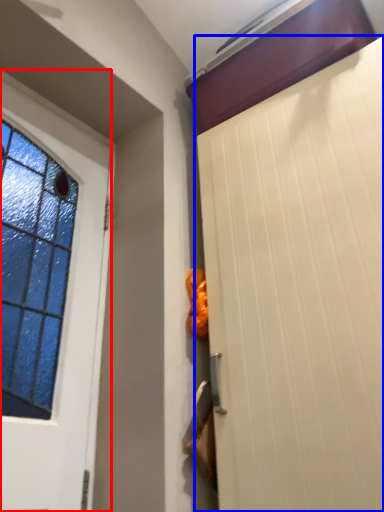
Question: Which of the following is the farthest to the observer, door (highlighted by a red box) or door (highlighted by a blue box)?

Choices:
 (A) door
 (B) door

Answer: (A)